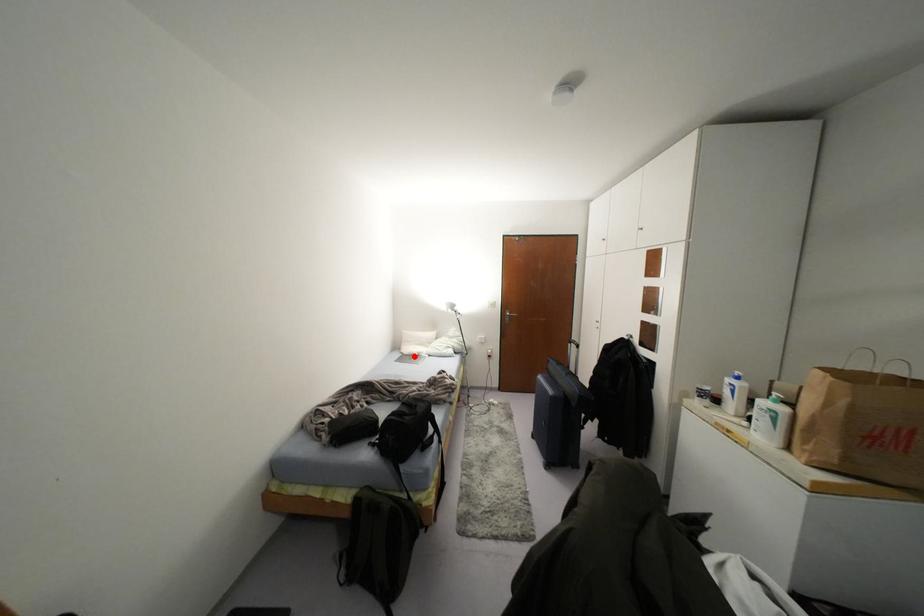
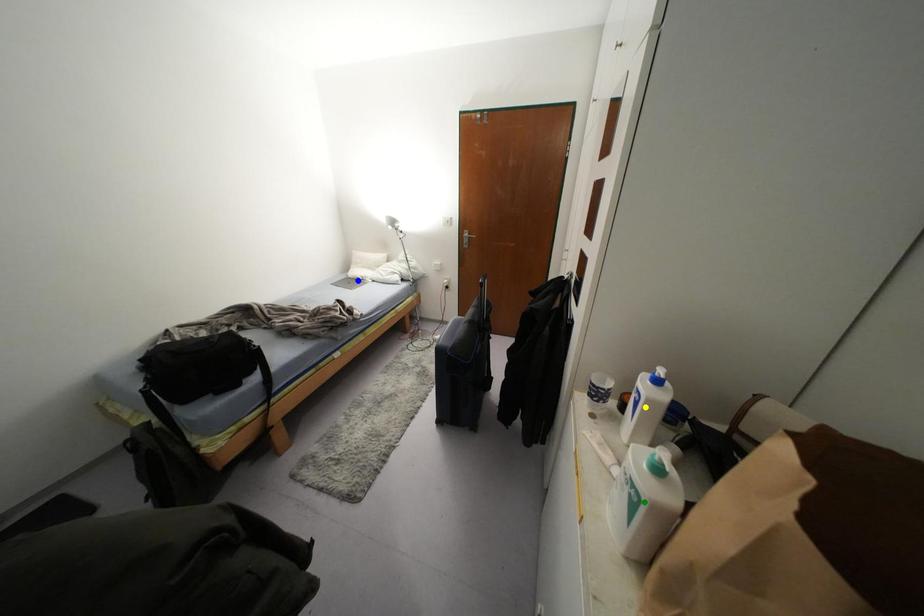
Question: I am providing you with two images of the same scene from different viewpoints. A red point is marked on the first image. You are given multiple points on the second image. Can you choose the point in image 2 that corresponds to the point in image 1?

Choices:
 (A) blue point
 (B) green point
 (C) yellow point

Answer: (A)